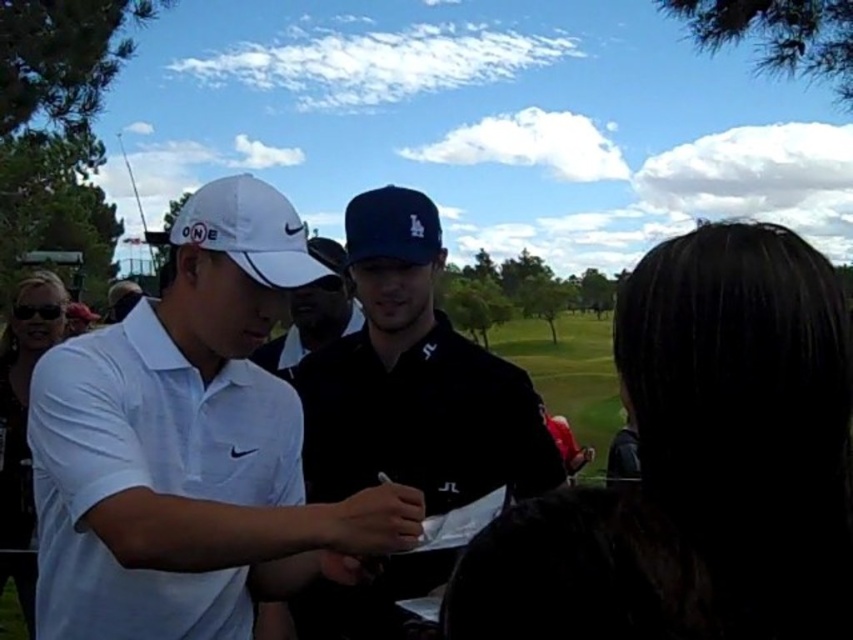
Question: Which point is closer to the camera taking this photo?

Choices:
 (A) (837, 516)
 (B) (235, 234)

Answer: (A)

Question: Is white matte shirt at center to the right of matte black cap at center from the viewer's perspective?

Choices:
 (A) no
 (B) yes

Answer: (A)

Question: Which point appears farthest from the camera in this image?

Choices:
 (A) (86, 461)
 (B) (252, 189)
 (C) (341, 268)
 (D) (735, 577)

Answer: (C)

Question: Among these points, which one is nearest to the camera?

Choices:
 (A) (51, 522)
 (B) (523, 396)
 (C) (271, 348)

Answer: (A)

Question: Is white matte shirt at center wider than blue fabric baseball cap at center?

Choices:
 (A) yes
 (B) no

Answer: (A)

Question: Where is matte black cap at center located in relation to white matte baseball cap at left in the image?

Choices:
 (A) left
 (B) right

Answer: (B)